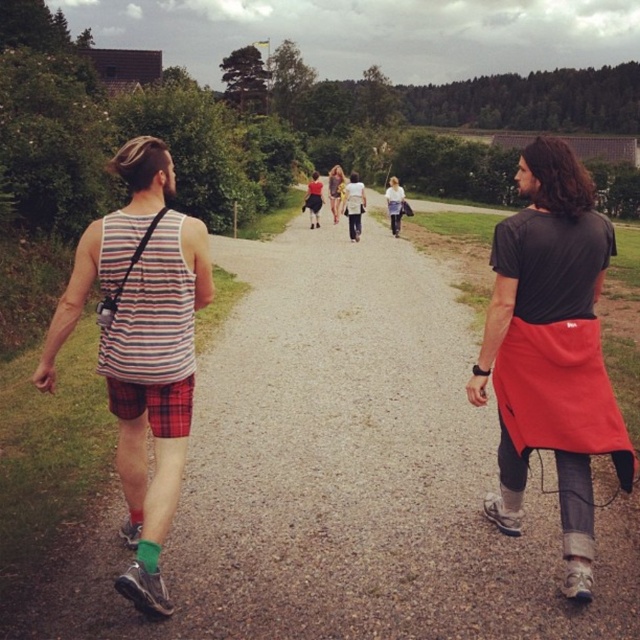
Question: Which is nearer to the light blue denim jeans at center?

Choices:
 (A) red fabric apron at right
 (B) matte black tank top at center

Answer: (B)

Question: Among these objects, which one is farthest from the camera?

Choices:
 (A) matte black tank top at center
 (B) striped fabric tank top at left
 (C) light blue denim jeans at center
 (D) red fabric apron at right

Answer: (A)

Question: Is light blue denim jeans at center bigger than matte black tank top at center?

Choices:
 (A) yes
 (B) no

Answer: (B)

Question: Which of the following is the farthest from the observer?

Choices:
 (A) (387, 205)
 (B) (548, 260)

Answer: (A)

Question: Is red fabric apron at right to the right of matte black tank top at center from the viewer's perspective?

Choices:
 (A) no
 (B) yes

Answer: (B)

Question: From the image, what is the correct spatial relationship of striped fabric tank top at left in relation to light blue denim jeans at center?

Choices:
 (A) right
 (B) left

Answer: (B)